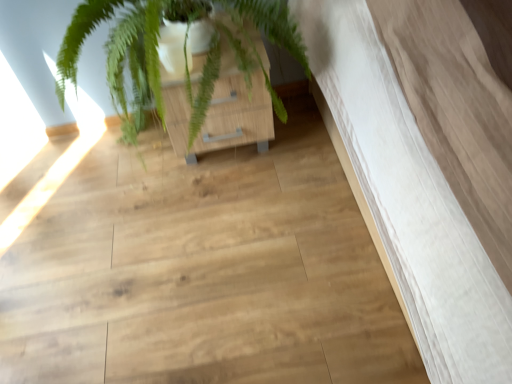
Locate an element on the screen. The image size is (512, 384). free space in front of wooden cabinet at center is located at coordinates (234, 203).